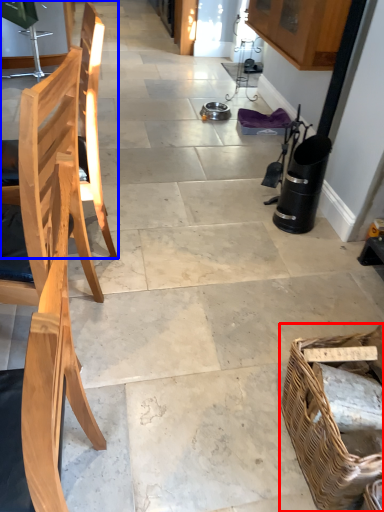
Question: Which object is further to the camera taking this photo, picnic basket (highlighted by a red box) or chair (highlighted by a blue box)?

Choices:
 (A) picnic basket
 (B) chair

Answer: (B)